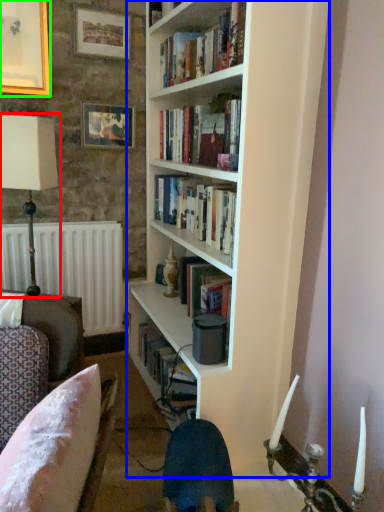
Question: Which is nearer to the table lamp (highlighted by a red box)? bookcase (highlighted by a blue box) or picture frame (highlighted by a green box).

Choices:
 (A) bookcase
 (B) picture frame

Answer: (B)